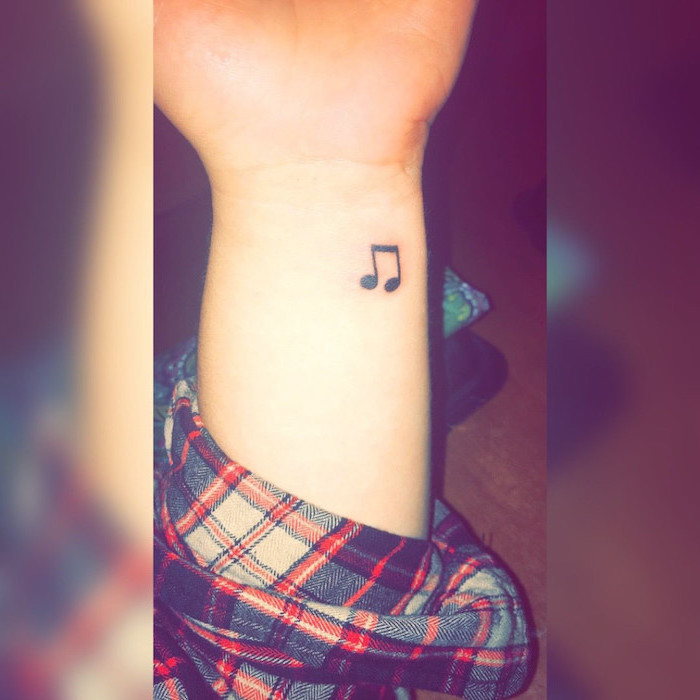
I want to click on corner of item laying on the floor, so click(528, 206).